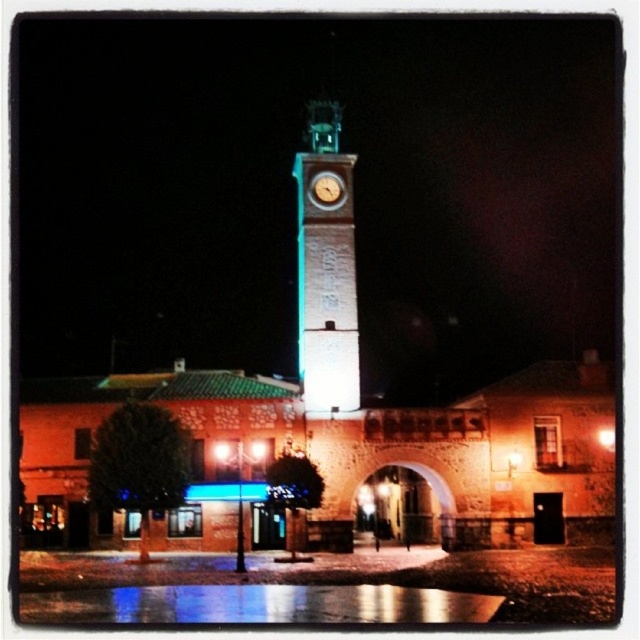
Question: Estimate the real-world distances between objects in this image. Which object is farther from the dark stone archway at center?

Choices:
 (A) white stone clock tower at center
 (B) matte gold clock at center

Answer: (B)

Question: Is white stone clock tower at center wider than dark stone archway at center?

Choices:
 (A) no
 (B) yes

Answer: (A)

Question: Can you confirm if brick wall archway at center is wider than matte gold clock at center?

Choices:
 (A) no
 (B) yes

Answer: (B)

Question: Estimate the real-world distances between objects in this image. Which object is closer to the matte gold clock at center?

Choices:
 (A) brick wall archway at center
 (B) dark stone archway at center
 (C) white stone clock tower at center

Answer: (C)

Question: Among these points, which one is farthest from the camera?

Choices:
 (A) (308, 182)
 (B) (323, 403)
 (C) (433, 524)

Answer: (C)

Question: Is brick wall archway at center wider than dark stone archway at center?

Choices:
 (A) yes
 (B) no

Answer: (A)